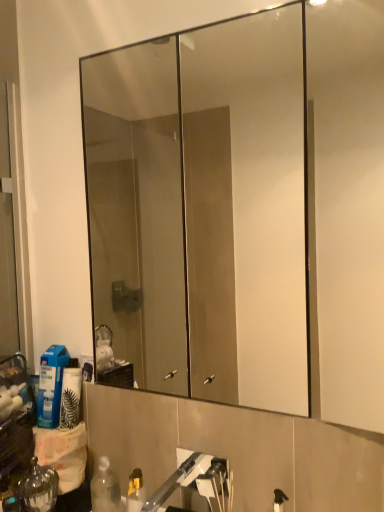
Question: Is clear glass mirror at upper center inside or outside of blue plastic bottle at lower left?

Choices:
 (A) outside
 (B) inside

Answer: (A)

Question: Is clear glass mirror at upper center wider or thinner than blue plastic bottle at lower left?

Choices:
 (A) wide
 (B) thin

Answer: (B)

Question: Which of these objects is positioned closest to the blue plastic bottle at lower left?

Choices:
 (A) clear glass mirror at upper center
 (B) shiny metallic bottle at lower left
 (C) brushed metal faucet at lower center

Answer: (B)

Question: Which of these objects is positioned closest to the shiny metallic bottle at lower left?

Choices:
 (A) brushed metal faucet at lower center
 (B) clear glass mirror at upper center
 (C) blue plastic bottle at lower left

Answer: (C)